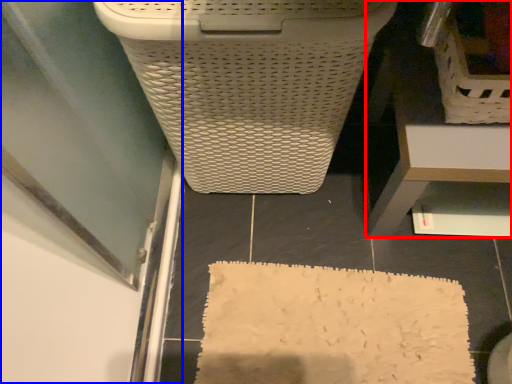
Question: Which object appears farthest to the camera in this image, furniture (highlighted by a red box) or screen door (highlighted by a blue box)?

Choices:
 (A) furniture
 (B) screen door

Answer: (B)